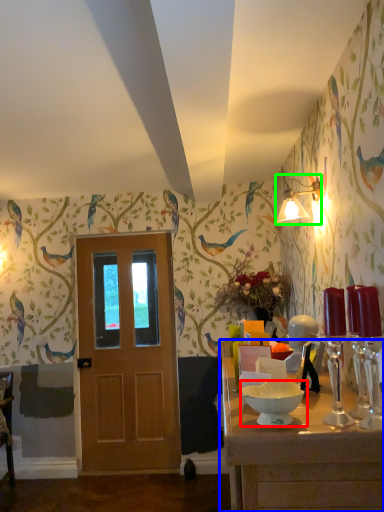
Question: Estimate the real-world distances between objects in this image. Which object is farther from bowl (highlighted by a red box), table (highlighted by a blue box) or light fixture (highlighted by a green box)?

Choices:
 (A) table
 (B) light fixture

Answer: (B)